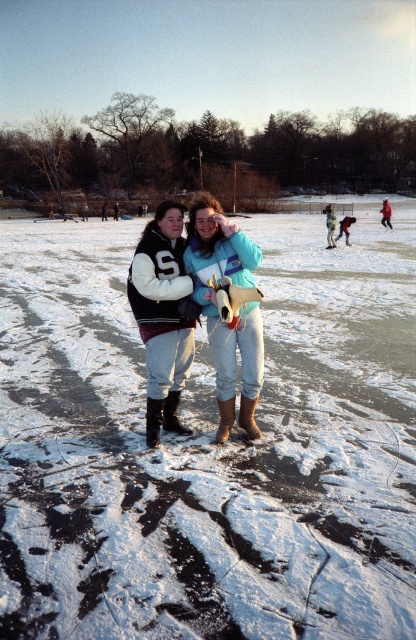
You are a photographer trying to capture both the white fleece jacket at center and the matte blue jacket at center in a single frame. Based on their positions, which jacket might require you to adjust your camera angle to include its full width?

The white fleece jacket at center might be wider than the matte blue jacket at center, so adjusting the camera angle could help include its full width.

You are standing at the edge of the ice rink and notice the white matte snow at center and the white fleece jacket at center. Which object is positioned higher relative to the other?

The white matte snow at center is above the white fleece jacket at center, so it is positioned higher.

You are a photographer standing at the edge of the ice rink. You want to take a photo of the white fleece jacket at center and the white matte snow at center. How far apart are these two objects in the scene?

The white matte snow at center is 7.09 meters from the white fleece jacket at center.